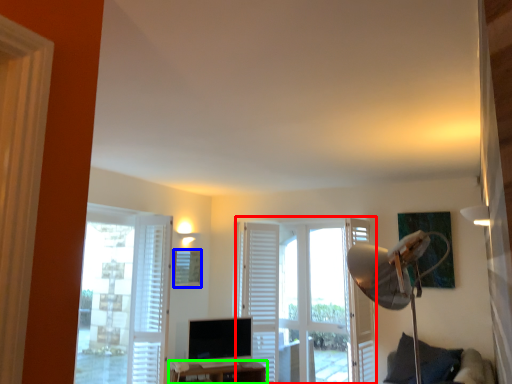
Question: Considering the real-world distances, which object is farthest from door (highlighted by a red box)? picture frame (highlighted by a blue box) or furniture (highlighted by a green box)?

Choices:
 (A) picture frame
 (B) furniture

Answer: (A)